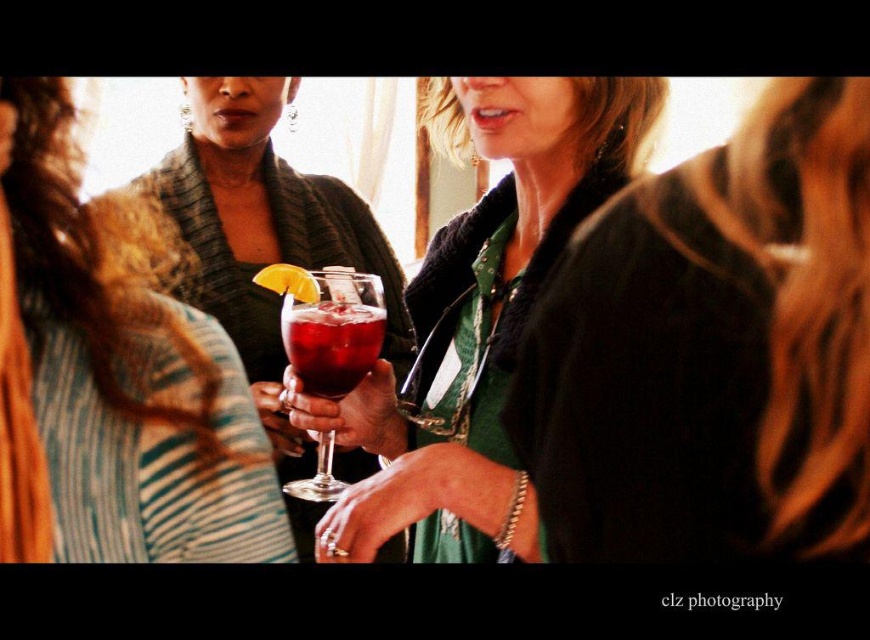
Question: Can you confirm if matte black dress at center is thinner than matte glass wine at center?

Choices:
 (A) yes
 (B) no

Answer: (A)

Question: Considering the real-world distances, which object is closest to the matte glass wine at center?

Choices:
 (A) translucent glass wine glass at center
 (B) green fabric dress at center

Answer: (A)

Question: Which of the following is the closest to the observer?

Choices:
 (A) (345, 376)
 (B) (138, 244)
 (C) (447, 340)
 (D) (313, 490)

Answer: (A)

Question: Does matte glass wine at center appear on the left side of matte glass at center?

Choices:
 (A) yes
 (B) no

Answer: (B)

Question: Considering the real-world distances, which object is closest to the translucent glass wine glass at center?

Choices:
 (A) matte glass at center
 (B) translucent glass at center
 (C) green fabric dress at center

Answer: (B)

Question: Does matte black dress at center have a lesser width compared to matte glass wine at center?

Choices:
 (A) yes
 (B) no

Answer: (A)